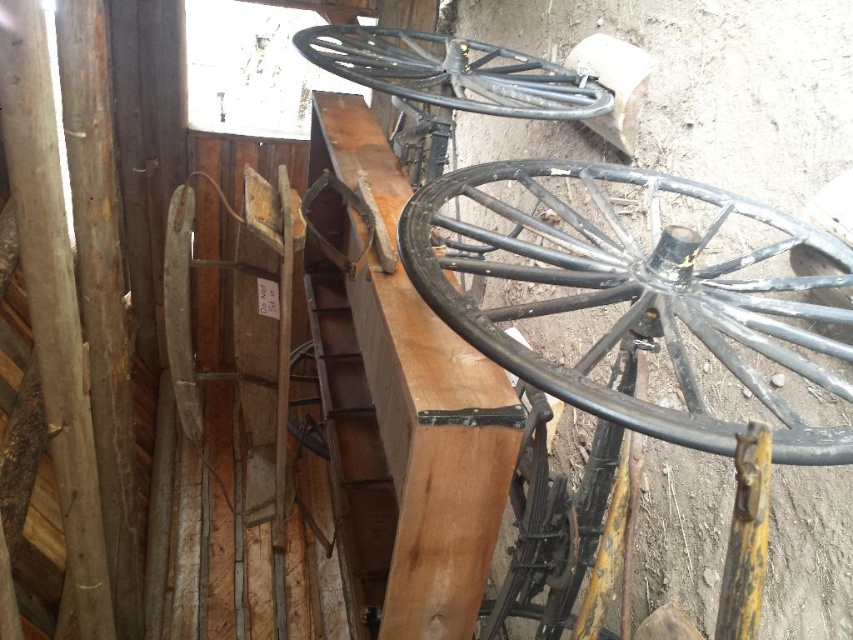
Is black metal/wrought iron wagon wheel at center smaller than brown wooden plank at center?

Yes.

Does black metal/wrought iron wagon wheel at center have a greater width compared to brown wooden plank at center?

Correct, the width of black metal/wrought iron wagon wheel at center exceeds that of brown wooden plank at center.

The width and height of the screenshot is (853, 640). What do you see at coordinates (637, 292) in the screenshot?
I see `black metal/wrought iron wagon wheel at center` at bounding box center [637, 292].

Identify the location of black metal/wrought iron wagon wheel at center. (637, 292).

Who is more forward, (x=387, y=464) or (x=289, y=416)?

Point (x=387, y=464) is in front.

Can you confirm if brown wooden plank at center is taller than black metal/wire wheel at center?

Indeed, brown wooden plank at center has a greater height compared to black metal/wire wheel at center.

You are a GUI agent. You are given a task and a screenshot of the screen. Output one action in this format:
    pyautogui.click(x=<x>, y=<y>)
    Task: Click on the brown wooden plank at center
    The image size is (853, 640).
    Given the screenshot: What is the action you would take?
    pyautogui.click(x=416, y=412)

Can you confirm if black metal/wrought iron wagon wheel at upper center is shorter than black metal/wire wheel at center?

Incorrect, black metal/wrought iron wagon wheel at upper center's height does not fall short of black metal/wire wheel at center's.

Which is in front, point (515, 68) or point (292, 426)?

Point (515, 68) is more forward.

Who is more distant from viewer, [426,61] or [311,358]?

Point [311,358]

Identify the location of black metal/wrought iron wagon wheel at upper center. The height and width of the screenshot is (640, 853). (453, 72).